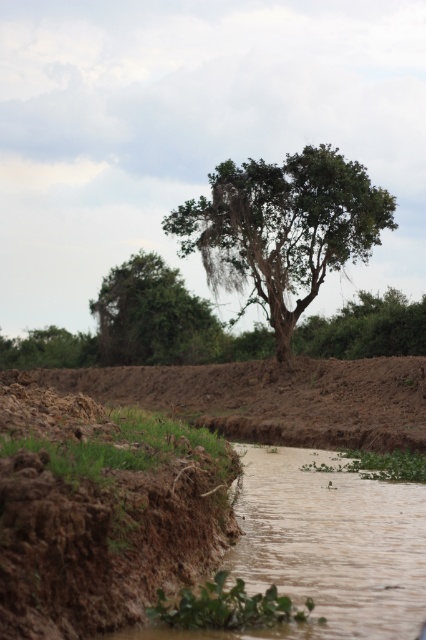
You are a farmer who needs to cross the brown muddy field at center to reach the irrigation ditch. Based on the coordinates provided, can you determine if the field is located to the north or south of the ditch?

The brown muddy field at center is located at coordinates point (x=273, y=397), so it is positioned to the south of the irrigation ditch.

You are standing at the point marked as point (152, 316). What object is exactly at this location?

The green leafy tree at upper center is exactly at point (152, 316).